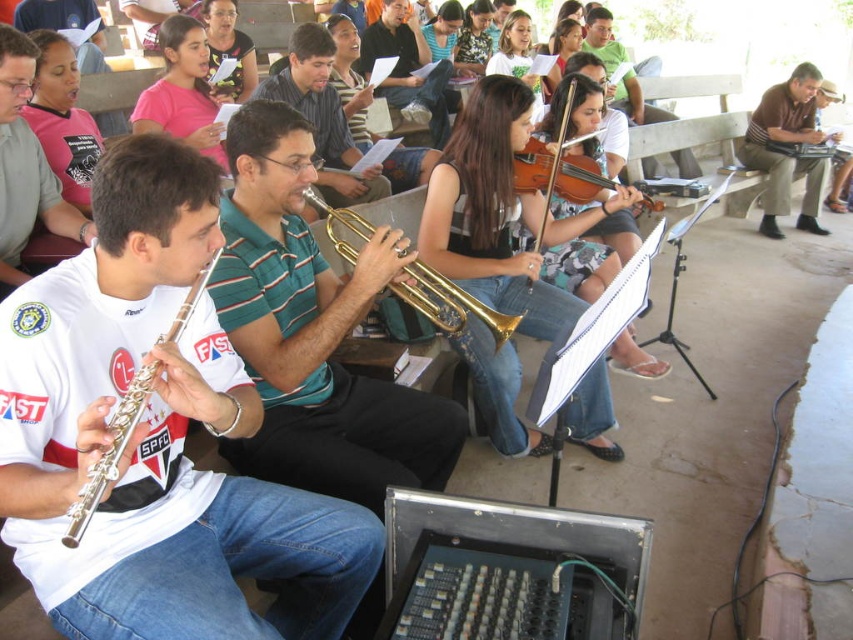
Question: Which object is the farthest from the silver metallic flute at left?

Choices:
 (A) matte green shirt at center
 (B) matte green shirt at upper center

Answer: (B)

Question: Which of the following is the closest to the observer?

Choices:
 (A) (106, 454)
 (B) (287, 449)
 (C) (428, 321)

Answer: (A)

Question: Which of the following is the farthest from the observer?

Choices:
 (A) shiny green shirt at center
 (B) matte green shirt at center

Answer: (B)

Question: Is brown cotton shirt at upper right wider than shiny green shirt at center?

Choices:
 (A) yes
 (B) no

Answer: (A)

Question: Can you confirm if gold shiny trumpet at center is smaller than wooden violin at center?

Choices:
 (A) yes
 (B) no

Answer: (A)

Question: Does brown cotton shirt at upper right come in front of gold shiny trumpet at center?

Choices:
 (A) no
 (B) yes

Answer: (A)